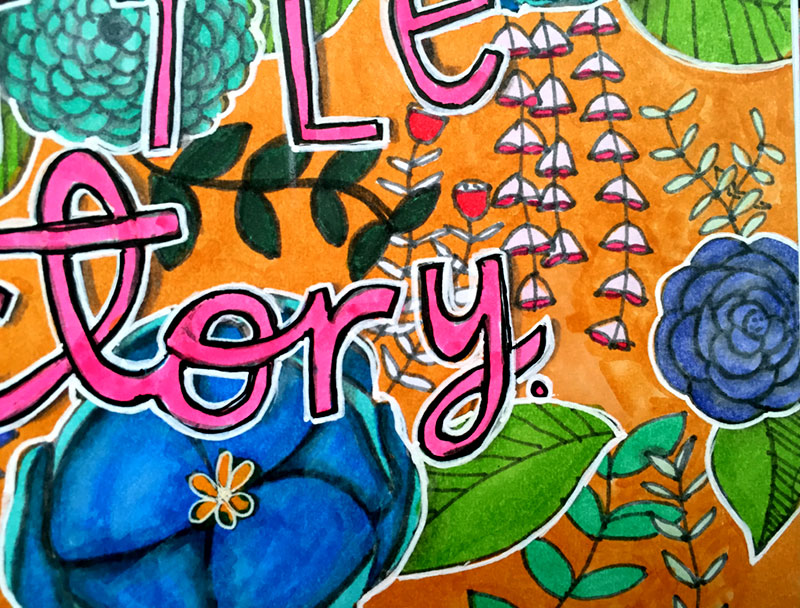
The width and height of the screenshot is (800, 608). Identify the location of hanging flowers. (610, 148), (564, 247), (536, 246).